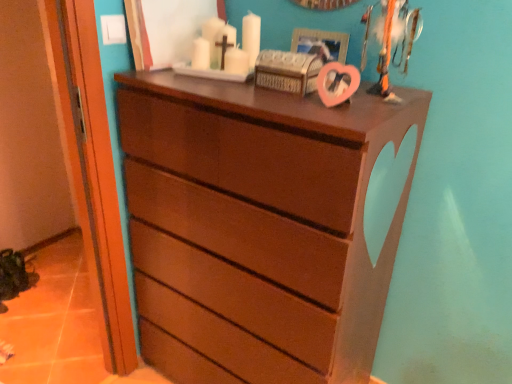
The height and width of the screenshot is (384, 512). What do you see at coordinates (93, 173) in the screenshot?
I see `matte wood door at left` at bounding box center [93, 173].

This screenshot has height=384, width=512. In order to click on pink matte picture frame at upper center in this screenshot , I will do `click(321, 43)`.

Is matte wood door at left not near metallic silver trophy at upper right?

That's not correct — matte wood door at left is a little close to metallic silver trophy at upper right.

Is metallic silver trophy at upper right at the back of matte wood door at left?

That's not correct — matte wood door at left is not looking away from metallic silver trophy at upper right.

Is matte wood door at left further to the viewer compared to metallic silver trophy at upper right?

No, matte wood door at left is closer to the camera.

Can you confirm if matte brown chest of drawers at center is wider than metallic silver trophy at upper right?

Yes, matte brown chest of drawers at center is wider than metallic silver trophy at upper right.

Which is behind, matte brown chest of drawers at center or metallic silver trophy at upper right?

metallic silver trophy at upper right is further away from the camera.

You are a GUI agent. You are given a task and a screenshot of the screen. Output one action in this format:
    pyautogui.click(x=<x>, y=<y>)
    Task: Click on the chest of drawers beneath the metallic silver trophy at upper right (from a real-world perspective)
    The image size is (512, 384).
    Given the screenshot: What is the action you would take?
    pyautogui.click(x=263, y=225)

Based on the photo, considering the sizes of objects matte brown chest of drawers at center and metallic silver trophy at upper right in the image provided, who is taller, matte brown chest of drawers at center or metallic silver trophy at upper right?

With more height is matte brown chest of drawers at center.

Does matte brown chest of drawers at center appear on the right side of matte wood door at left?

Correct, you'll find matte brown chest of drawers at center to the right of matte wood door at left.

Is matte brown chest of drawers at center positioned far away from matte wood door at left?

No.

How different are the orientations of matte brown chest of drawers at center and matte wood door at left in degrees?

The angle between the facing direction of matte brown chest of drawers at center and the facing direction of matte wood door at left is 87.6 degrees.

Does point (314, 169) come in front of point (73, 163)?

Yes, point (314, 169) is in front of point (73, 163).

Does matte brown chest of drawers at center have a greater height compared to pink matte picture frame at upper center?

Yes, matte brown chest of drawers at center is taller than pink matte picture frame at upper center.

Looking at this image, who is smaller, matte brown chest of drawers at center or pink matte picture frame at upper center?

pink matte picture frame at upper center.

Does point (190, 360) come farther from viewer compared to point (347, 40)?

Yes.

From a real-world perspective, is matte brown chest of drawers at center physically below pink matte picture frame at upper center?

Yes, from a real-world perspective, matte brown chest of drawers at center is beneath pink matte picture frame at upper center.

From the image's perspective, is metallic silver trophy at upper right beneath matte brown chest of drawers at center?

No, from the image's perspective, metallic silver trophy at upper right is not below matte brown chest of drawers at center.

Which is behind, point (419, 27) or point (406, 199)?

The point (406, 199) is farther.

Considering the relative positions of metallic silver trophy at upper right and matte brown chest of drawers at center in the image provided, is metallic silver trophy at upper right to the left or to the right of matte brown chest of drawers at center?

Based on their positions, metallic silver trophy at upper right is located to the right of matte brown chest of drawers at center.

Is metallic silver trophy at upper right turned away from matte brown chest of drawers at center?

No.

Where is `chest of drawers below the matte wood door at left (from a real-world perspective)`? chest of drawers below the matte wood door at left (from a real-world perspective) is located at coordinates (263, 225).

What's the angular difference between matte wood door at left and matte brown chest of drawers at center's facing directions?

They differ by 87.6 degrees in their facing directions.

Is matte brown chest of drawers at center completely or partially inside matte wood door at left?

No, matte brown chest of drawers at center is not surrounded by matte wood door at left.

Considering the positions of objects matte wood door at left and matte brown chest of drawers at center in the image provided, who is more to the right, matte wood door at left or matte brown chest of drawers at center?

From the viewer's perspective, matte brown chest of drawers at center appears more on the right side.

Find the location of a particular element. The width and height of the screenshot is (512, 384). door located underneath the metallic silver trophy at upper right (from a real-world perspective) is located at coordinates (93, 173).

Can you confirm if metallic silver trophy at upper right is smaller than matte wood door at left?

Indeed, metallic silver trophy at upper right has a smaller size compared to matte wood door at left.

From the image's perspective, would you say metallic silver trophy at upper right is positioned over matte wood door at left?

Yes.

Can you see metallic silver trophy at upper right touching matte wood door at left?

No, metallic silver trophy at upper right is not beside matte wood door at left.

The height and width of the screenshot is (384, 512). I want to click on toy on the right of matte wood door at left, so click(394, 42).

Image resolution: width=512 pixels, height=384 pixels. Find the location of `toy that is above the matte brown chest of drawers at center (from the image's perspective)`. toy that is above the matte brown chest of drawers at center (from the image's perspective) is located at coordinates (394, 42).

Estimate the real-world distances between objects in this image. Which object is further from matte brown chest of drawers at center, matte wood door at left or metallic silver trophy at upper right?

metallic silver trophy at upper right.

From the image, which object appears to be nearer to matte wood door at left, matte brown chest of drawers at center or pink matte picture frame at upper center?

matte brown chest of drawers at center lies closer to matte wood door at left than the other object.

Considering their positions, is metallic silver trophy at upper right positioned further to matte wood door at left than matte brown chest of drawers at center?

metallic silver trophy at upper right is further to matte wood door at left.

Based on their spatial positions, is matte brown chest of drawers at center or matte wood door at left closer to pink matte picture frame at upper center?

matte brown chest of drawers at center.

From the image, which object appears to be farther from matte brown chest of drawers at center, metallic silver trophy at upper right or matte wood door at left?

The object further to matte brown chest of drawers at center is metallic silver trophy at upper right.

Looking at the image, which one is located further to matte wood door at left, matte brown chest of drawers at center or metallic silver trophy at upper right?

Based on the image, metallic silver trophy at upper right appears to be further to matte wood door at left.

When comparing their distances from metallic silver trophy at upper right, does matte brown chest of drawers at center or pink matte picture frame at upper center seem closer?

pink matte picture frame at upper center.

When comparing their distances from metallic silver trophy at upper right, does pink matte picture frame at upper center or matte brown chest of drawers at center seem closer?

The object closer to metallic silver trophy at upper right is pink matte picture frame at upper center.

Find the location of a particular element. This screenshot has height=384, width=512. picture frame between matte wood door at left and metallic silver trophy at upper right from left to right is located at coordinates (321, 43).

Where is `chest of drawers between matte wood door at left and pink matte picture frame at upper center in the horizontal direction`? The width and height of the screenshot is (512, 384). chest of drawers between matte wood door at left and pink matte picture frame at upper center in the horizontal direction is located at coordinates (263, 225).

Locate an element on the screen. The image size is (512, 384). toy that lies between pink matte picture frame at upper center and matte brown chest of drawers at center from top to bottom is located at coordinates (394, 42).

Identify the location of the chest of drawers located between matte wood door at left and metallic silver trophy at upper right in the left-right direction. (263, 225).